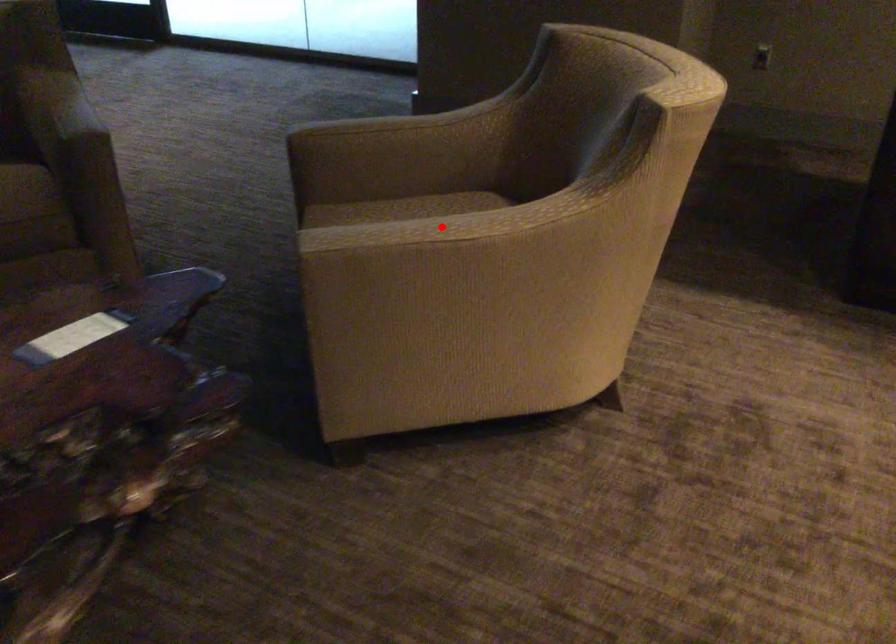
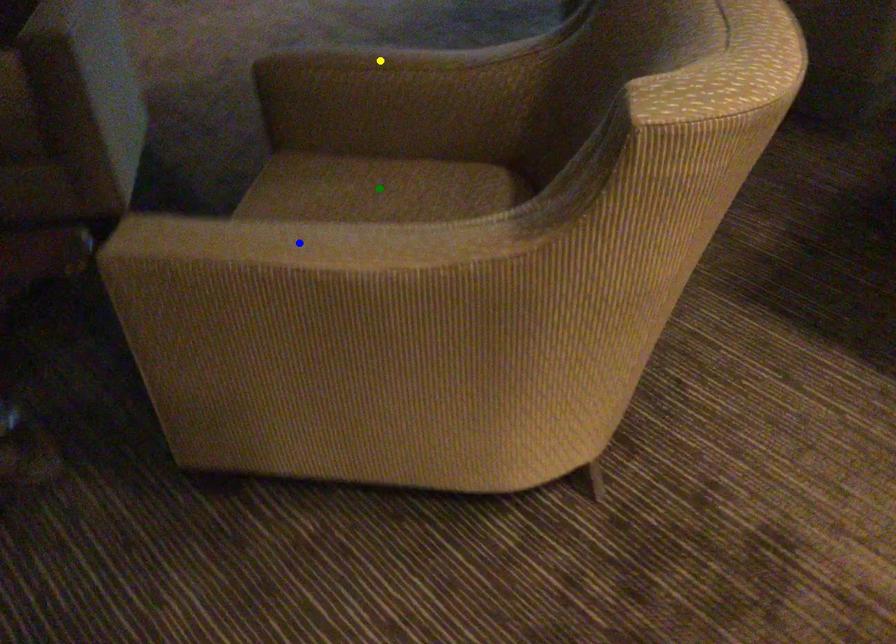
Question: I am providing you with two images of the same scene from different viewpoints. A red point is marked on the first image. You are given multiple points on the second image. Can you choose the point in image 2 that corresponds to the point in image 1?

Choices:
 (A) green point
 (B) yellow point
 (C) blue point

Answer: (C)